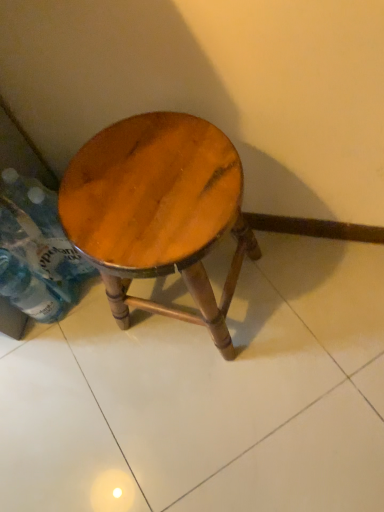
In order to face translucent plastic bottle at lower left, placed as the 1th bottle when sorted from top to bottom, should I rotate leftwards or rightwards?

You should look left and rotate roughly 19.761 degrees.

Describe the element at coordinates (28, 290) in the screenshot. The height and width of the screenshot is (512, 384). I see `clear plastic bottle at lower left, the 1th bottle when ordered from bottom to top` at that location.

You are a GUI agent. You are given a task and a screenshot of the screen. Output one action in this format:
    pyautogui.click(x=<x>, y=<y>)
    Task: Click on the wooden stool at center
    This screenshot has width=384, height=512.
    Given the screenshot: What is the action you would take?
    pyautogui.click(x=158, y=212)

Locate an element on the screen. translucent plastic bottle at lower left, which is counted as the second bottle, starting from the bottom is located at coordinates (39, 234).

Is point (83, 254) positioned before point (65, 253)?

Yes, it is in front of point (65, 253).

Is wooden stool at center positioned beyond the bounds of translucent plastic bottle at lower left, placed as the 1th bottle when sorted from top to bottom?

That's correct, wooden stool at center is outside of translucent plastic bottle at lower left, placed as the 1th bottle when sorted from top to bottom.

Between wooden stool at center and translucent plastic bottle at lower left, which is counted as the second bottle, starting from the bottom, which one is positioned behind?

translucent plastic bottle at lower left, which is counted as the second bottle, starting from the bottom, is behind.

From the picture: Considering the relative positions of wooden stool at center and translucent plastic bottle at lower left, placed as the 1th bottle when sorted from top to bottom, in the image provided, is wooden stool at center to the left or to the right of translucent plastic bottle at lower left, placed as the 1th bottle when sorted from top to bottom,?

In the image, wooden stool at center appears on the right side of translucent plastic bottle at lower left, placed as the 1th bottle when sorted from top to bottom.

Who is smaller, translucent plastic bottle at lower left, placed as the 1th bottle when sorted from top to bottom, or clear plastic bottle at lower left, the 1th bottle when ordered from bottom to top?

Smaller between the two is clear plastic bottle at lower left, the 1th bottle when ordered from bottom to top.

Does point (45, 220) come behind point (42, 292)?

No, it is not.

Which object is thinner, translucent plastic bottle at lower left, placed as the 1th bottle when sorted from top to bottom, or clear plastic bottle at lower left, the second bottle positioned from the top?

Thinner between the two is translucent plastic bottle at lower left, placed as the 1th bottle when sorted from top to bottom.

Is translucent plastic bottle at lower left, which is counted as the second bottle, starting from the bottom, not inside clear plastic bottle at lower left, the 1th bottle when ordered from bottom to top?

Absolutely, translucent plastic bottle at lower left, which is counted as the second bottle, starting from the bottom, is external to clear plastic bottle at lower left, the 1th bottle when ordered from bottom to top.

Between point (52, 267) and point (127, 178), which one is positioned behind?

Positioned behind is point (52, 267).

Can you confirm if translucent plastic bottle at lower left, which is counted as the second bottle, starting from the bottom, is taller than wooden stool at center?

No, translucent plastic bottle at lower left, which is counted as the second bottle, starting from the bottom, is not taller than wooden stool at center.

From a real-world perspective, which object rests below the other?

translucent plastic bottle at lower left, which is counted as the second bottle, starting from the bottom.

Which is behind, translucent plastic bottle at lower left, which is counted as the second bottle, starting from the bottom, or wooden stool at center?

translucent plastic bottle at lower left, which is counted as the second bottle, starting from the bottom, is more distant.

Looking at this image, how far apart are clear plastic bottle at lower left, the second bottle positioned from the top, and wooden stool at center?

clear plastic bottle at lower left, the second bottle positioned from the top, and wooden stool at center are 15.29 inches apart from each other.

Is clear plastic bottle at lower left, the second bottle positioned from the top, facing towards wooden stool at center?

No, clear plastic bottle at lower left, the second bottle positioned from the top, is not turned towards wooden stool at center.

Which is more to the left, clear plastic bottle at lower left, the second bottle positioned from the top, or wooden stool at center?

Positioned to the left is clear plastic bottle at lower left, the second bottle positioned from the top.

Which of these two, clear plastic bottle at lower left, the second bottle positioned from the top, or wooden stool at center, stands taller?

Standing taller between the two is wooden stool at center.

From a real-world perspective, is clear plastic bottle at lower left, the second bottle positioned from the top, physically above translucent plastic bottle at lower left, placed as the 1th bottle when sorted from top to bottom?

Yes, from a real-world perspective, clear plastic bottle at lower left, the second bottle positioned from the top, is over translucent plastic bottle at lower left, placed as the 1th bottle when sorted from top to bottom

Who is taller, clear plastic bottle at lower left, the second bottle positioned from the top, or translucent plastic bottle at lower left, placed as the 1th bottle when sorted from top to bottom?

clear plastic bottle at lower left, the second bottle positioned from the top, is taller.

This screenshot has width=384, height=512. What are the coordinates of `bottle that appears above the translucent plastic bottle at lower left, which is counted as the second bottle, starting from the bottom (from a real-world perspective)` in the screenshot? It's located at (28, 290).

Based on their positions, is wooden stool at center located to the left or right of clear plastic bottle at lower left, the second bottle positioned from the top?

Clearly, wooden stool at center is on the right of clear plastic bottle at lower left, the second bottle positioned from the top, in the image.

Which is correct: wooden stool at center is inside clear plastic bottle at lower left, the 1th bottle when ordered from bottom to top, or outside of it?

wooden stool at center is outside clear plastic bottle at lower left, the 1th bottle when ordered from bottom to top.

Are wooden stool at center and clear plastic bottle at lower left, the second bottle positioned from the top, beside each other?

No, wooden stool at center is not touching clear plastic bottle at lower left, the second bottle positioned from the top.

Image resolution: width=384 pixels, height=512 pixels. In order to click on stool located on the right of translucent plastic bottle at lower left, placed as the 1th bottle when sorted from top to bottom in this screenshot , I will do `click(158, 212)`.

Where is `bottle that is behind the clear plastic bottle at lower left, the second bottle positioned from the top`? This screenshot has width=384, height=512. bottle that is behind the clear plastic bottle at lower left, the second bottle positioned from the top is located at coordinates (39, 234).

From the image, which object appears to be farther from clear plastic bottle at lower left, the 1th bottle when ordered from bottom to top, translucent plastic bottle at lower left, which is counted as the second bottle, starting from the bottom, or wooden stool at center?

The object further to clear plastic bottle at lower left, the 1th bottle when ordered from bottom to top, is wooden stool at center.

Which object lies further to the anchor point clear plastic bottle at lower left, the 1th bottle when ordered from bottom to top, wooden stool at center or translucent plastic bottle at lower left, which is counted as the second bottle, starting from the bottom?

Based on the image, wooden stool at center appears to be further to clear plastic bottle at lower left, the 1th bottle when ordered from bottom to top.

Looking at the image, which one is located closer to wooden stool at center, clear plastic bottle at lower left, the 1th bottle when ordered from bottom to top, or translucent plastic bottle at lower left, which is counted as the second bottle, starting from the bottom?

Based on the image, translucent plastic bottle at lower left, which is counted as the second bottle, starting from the bottom, appears to be nearer to wooden stool at center.

When comparing their distances from translucent plastic bottle at lower left, placed as the 1th bottle when sorted from top to bottom, does wooden stool at center or clear plastic bottle at lower left, the second bottle positioned from the top, seem closer?

The object closer to translucent plastic bottle at lower left, placed as the 1th bottle when sorted from top to bottom, is clear plastic bottle at lower left, the second bottle positioned from the top.

Based on their spatial positions, is clear plastic bottle at lower left, the second bottle positioned from the top, or wooden stool at center closer to translucent plastic bottle at lower left, which is counted as the second bottle, starting from the bottom?

clear plastic bottle at lower left, the second bottle positioned from the top, is closer to translucent plastic bottle at lower left, which is counted as the second bottle, starting from the bottom.

When comparing their distances from wooden stool at center, does translucent plastic bottle at lower left, placed as the 1th bottle when sorted from top to bottom, or clear plastic bottle at lower left, the second bottle positioned from the top, seem closer?

Among the two, translucent plastic bottle at lower left, placed as the 1th bottle when sorted from top to bottom, is located nearer to wooden stool at center.

The width and height of the screenshot is (384, 512). I want to click on bottle between clear plastic bottle at lower left, the second bottle positioned from the top, and wooden stool at center, so click(x=39, y=234).